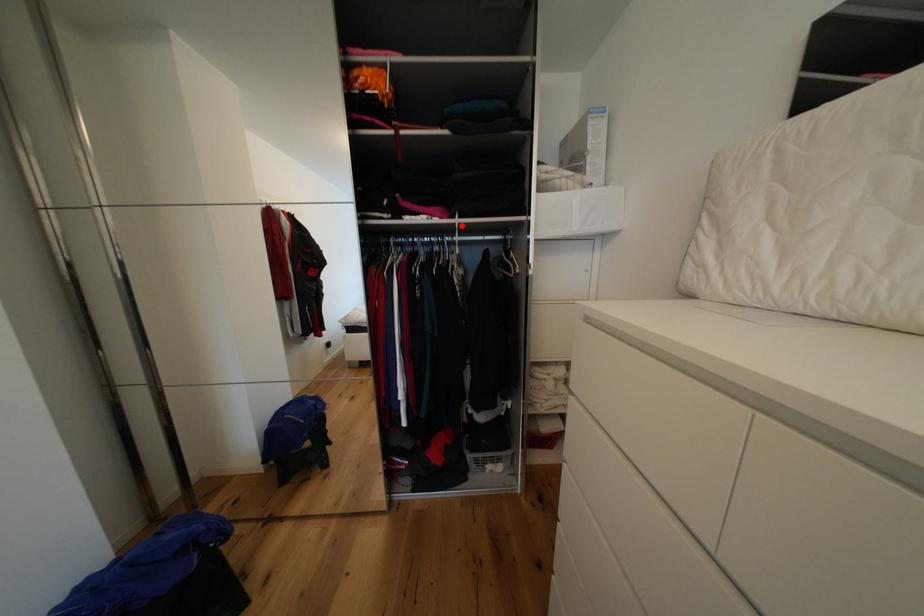
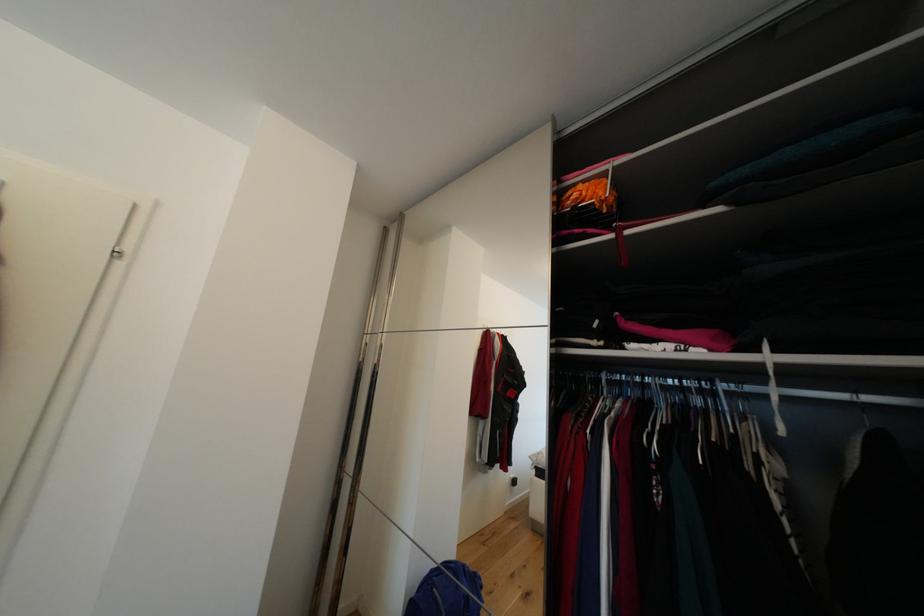
Find the pixel in the second image that matches the highlighted location in the first image.

(769, 367)